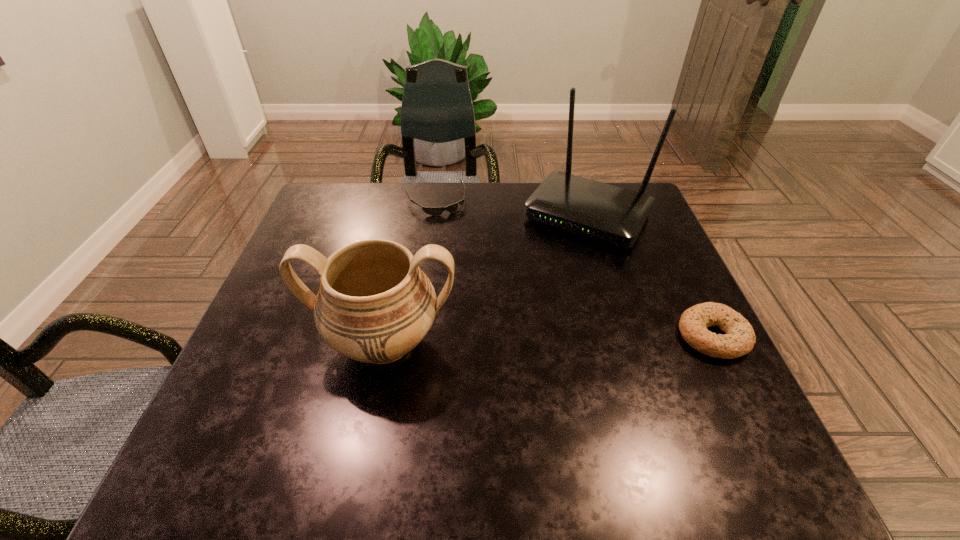
This screenshot has height=540, width=960. What are the coordinates of `free space at the far edge of the desktop` in the screenshot? It's located at (516, 195).

Image resolution: width=960 pixels, height=540 pixels. In the image, there is a desktop. Find the location of `vacant space at the near edge`. vacant space at the near edge is located at coordinates (520, 401).

In the image, there is a desktop. At what (x,y) coordinates should I click in order to perform the action: click on vacant space at the left edge. Please return your answer as a coordinate pair (x, y). The image size is (960, 540). Looking at the image, I should click on (253, 375).

In the image, there is a desktop. Where is `blank space at the right edge`? blank space at the right edge is located at coordinates (711, 361).

This screenshot has width=960, height=540. In order to click on vacant space at the far left corner of the desktop in this screenshot , I will do click(x=331, y=199).

Where is `vacant space at the near left corner of the desktop`? This screenshot has height=540, width=960. vacant space at the near left corner of the desktop is located at coordinates (296, 402).

Image resolution: width=960 pixels, height=540 pixels. In order to click on free area in between the shortest object and the tallest object in this screenshot , I will do `click(512, 208)`.

Image resolution: width=960 pixels, height=540 pixels. Find the location of `vacant area that lies between the router and the second tallest object`. vacant area that lies between the router and the second tallest object is located at coordinates (486, 279).

The height and width of the screenshot is (540, 960). Identify the location of vacant space that is in between the tallest object and the bagel. (650, 275).

The image size is (960, 540). Identify the location of free point between the bagel and the second tallest object. pos(549,339).